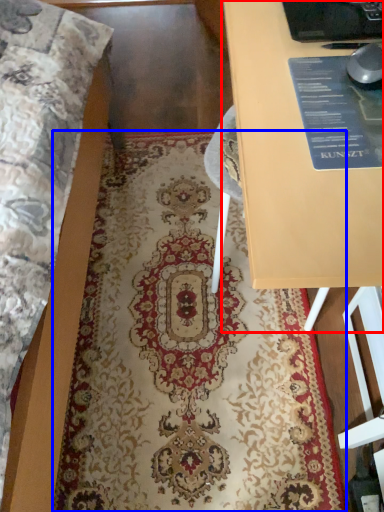
Question: Which object appears farthest to the camera in this image, table (highlighted by a red box) or mat (highlighted by a blue box)?

Choices:
 (A) table
 (B) mat

Answer: (B)